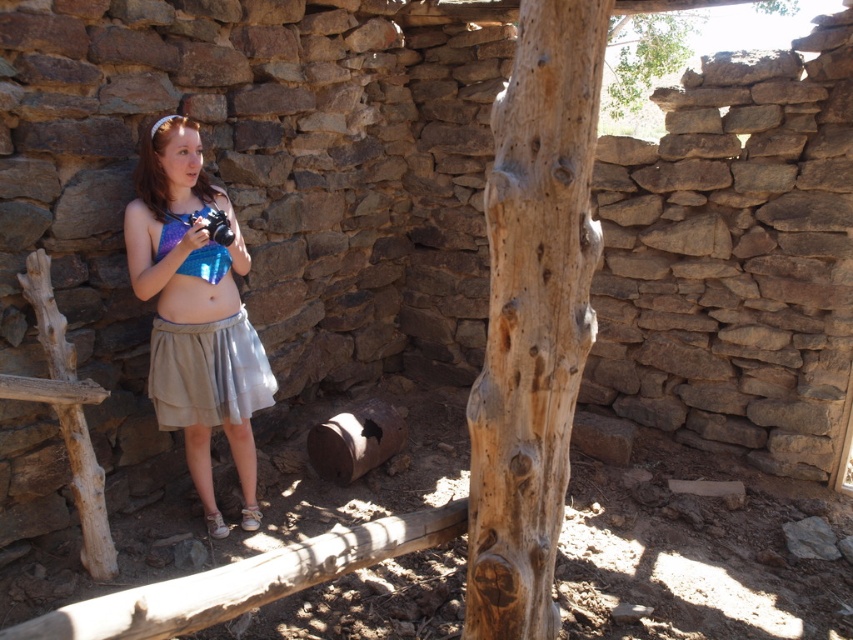
Who is more forward, (184,138) or (262,346)?

Point (184,138)

Is shiny blue fabric at center bigger than gray fabric skirt at lower left?

Yes.

Which is in front, point (190, 173) or point (218, 422)?

Point (190, 173) is more forward.

Identify the location of shiny blue fabric at center. This screenshot has height=640, width=853. (195, 312).

Locate an element on the screen. This screenshot has width=853, height=640. rough wood tree at upper center is located at coordinates pos(647,52).

What do you see at coordinates (647, 52) in the screenshot? The width and height of the screenshot is (853, 640). I see `rough wood tree at upper center` at bounding box center [647, 52].

The width and height of the screenshot is (853, 640). What are the coordinates of `rough wood tree at upper center` in the screenshot? It's located at (647, 52).

This screenshot has width=853, height=640. I want to click on rough wood tree at upper center, so click(647, 52).

Is light brown rough wood at center positioned in front of shiny blue fabric at center?

Yes, light brown rough wood at center is closer to the viewer.

Which is behind, point (577, 212) or point (132, 288)?

The point (132, 288) is more distant.

Is point (525, 540) behind point (177, 269)?

No, (525, 540) is closer to viewer.

Locate an element on the screen. The height and width of the screenshot is (640, 853). light brown rough wood at center is located at coordinates (532, 316).